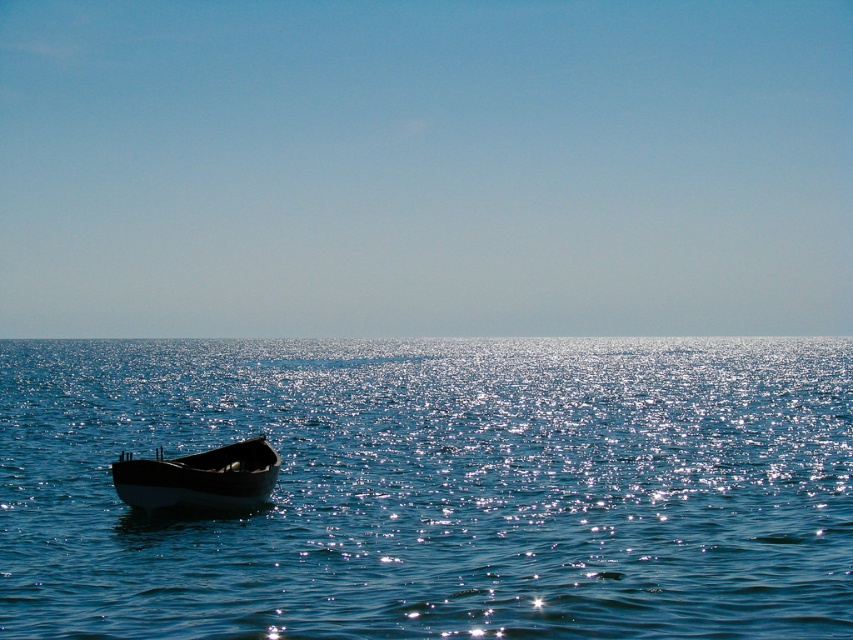
Consider the image. Is glistening blue water at center taller than wooden boat at lower left?

Yes, glistening blue water at center is taller than wooden boat at lower left.

Measure the distance from glistening blue water at center to wooden boat at lower left.

89.79 meters

Does point (457, 474) come behind point (113, 467)?

Yes, it is.

Identify the location of glistening blue water at center. (436, 486).